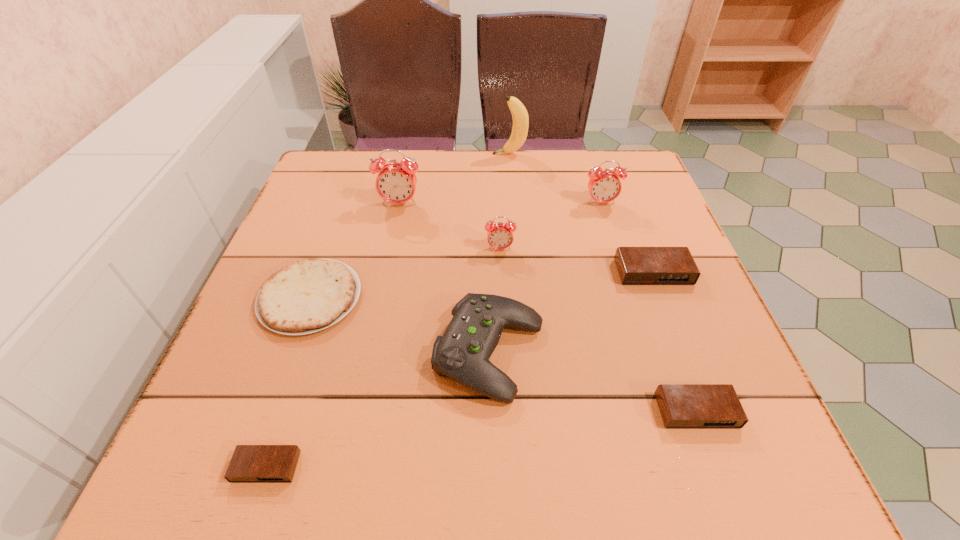
Locate an element on the screen. The image size is (960, 540). vacant space at the far edge of the desktop is located at coordinates (566, 201).

This screenshot has height=540, width=960. In the image, there is a desktop. Find the location of `blank space at the near edge`. blank space at the near edge is located at coordinates (608, 439).

Identify the location of vacant space at the left edge of the desktop. The image size is (960, 540). (294, 212).

Where is `blank space at the right edge of the desktop`? blank space at the right edge of the desktop is located at coordinates (712, 351).

At what (x,y) coordinates should I click in order to perform the action: click on vacant point at the near left corner. Please return your answer as a coordinate pair (x, y). Looking at the image, I should click on (276, 442).

The image size is (960, 540). I want to click on vacant region between the second nearest alarm clock and the third shortest alarm clock, so click(675, 342).

Identify the location of vacant space that's between the banana and the second smallest red alarm clock. pyautogui.click(x=555, y=179).

Image resolution: width=960 pixels, height=540 pixels. I want to click on free space between the beige tortilla and the leftmost alarm clock, so click(x=288, y=382).

The width and height of the screenshot is (960, 540). Identify the location of empty space that is in between the second biggest red alarm clock and the farthest black alarm clock. (627, 238).

The width and height of the screenshot is (960, 540). Find the location of `empty space that is in between the fourth farthest alarm clock and the second biggest black alarm clock`. empty space that is in between the fourth farthest alarm clock and the second biggest black alarm clock is located at coordinates (675, 342).